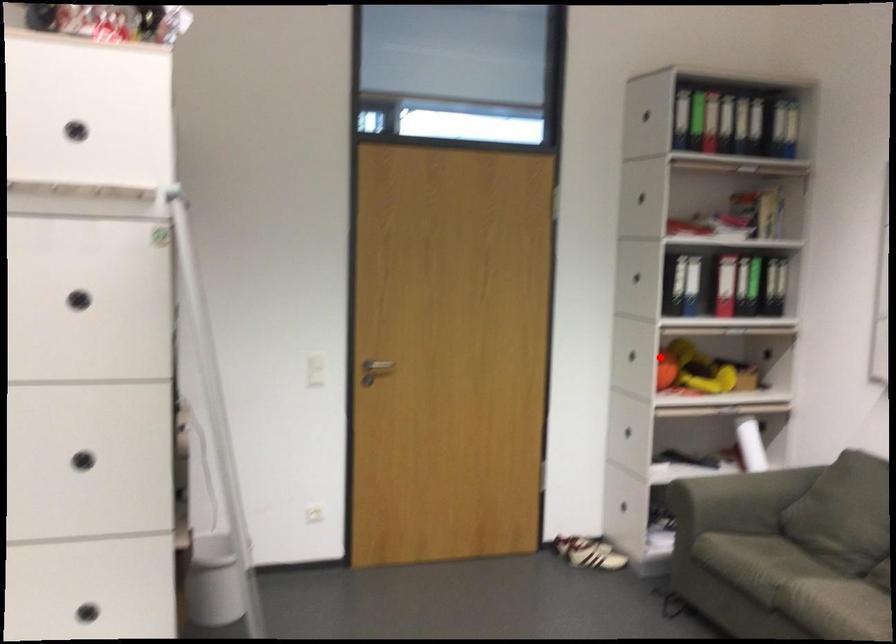
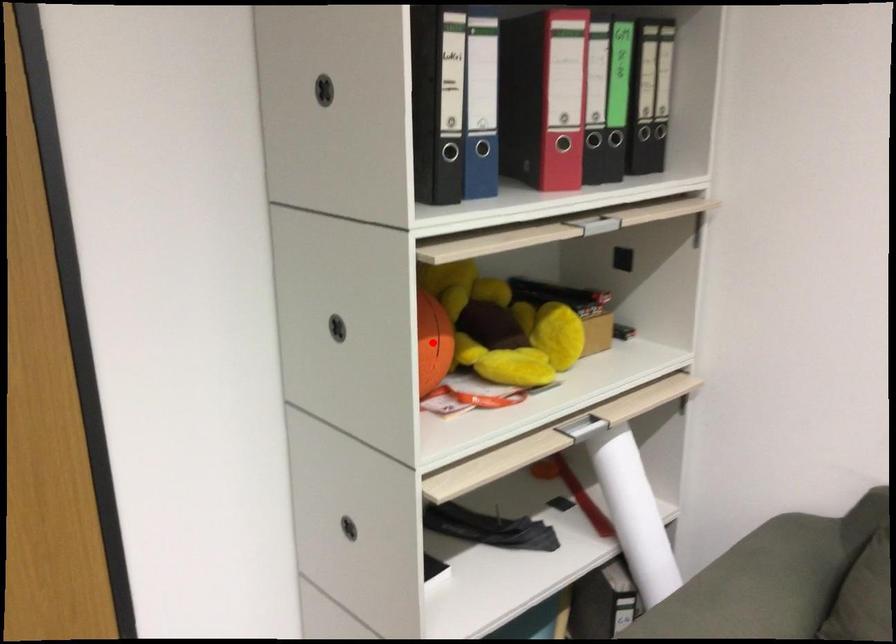
I am providing you with two images of the same scene from different viewpoints. A red point is marked on the first image and another point is marked on the second image. Is the red point in image1 aligned with the point shown in image2?

Yes